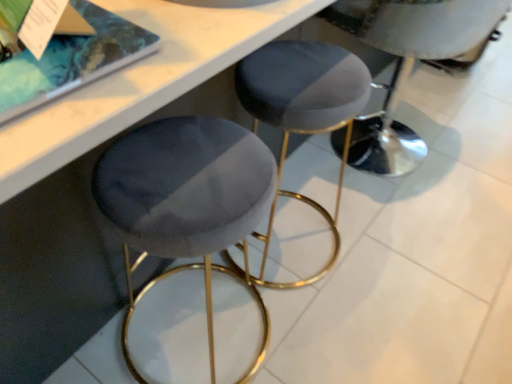
You are a GUI agent. You are given a task and a screenshot of the screen. Output one action in this format:
    pyautogui.click(x=<x>, y=<y>)
    Task: Click on the free location to the right of velvet grey stool at center
    This screenshot has width=512, height=384.
    Given the screenshot: What is the action you would take?
    pyautogui.click(x=388, y=253)